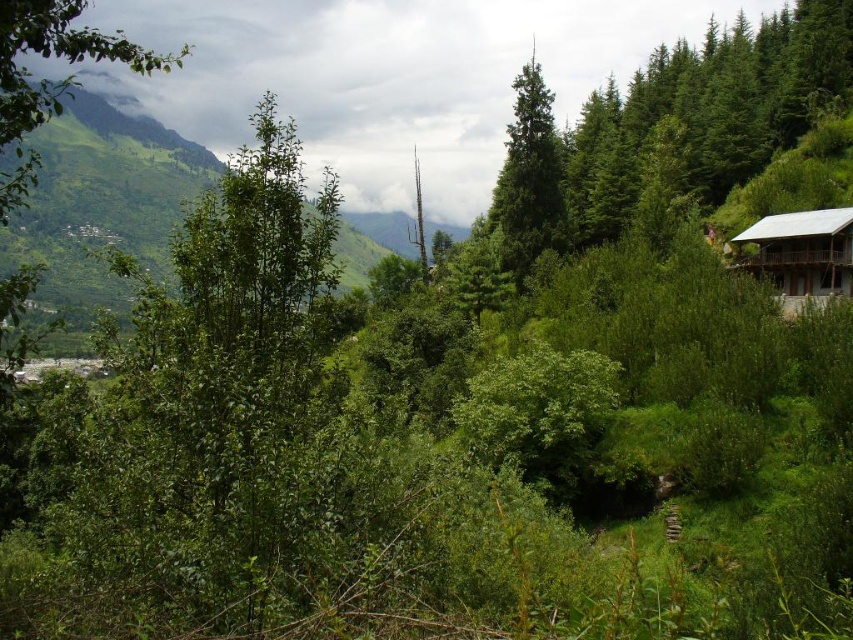
Question: Which is farther from the white wooden cabin at right?

Choices:
 (A) green matte tree at center
 (B) green matte tree at right

Answer: (B)

Question: Is green matte tree at right wider than green matte tree at center?

Choices:
 (A) no
 (B) yes

Answer: (B)

Question: Which point is closer to the camera taking this photo?

Choices:
 (A) (836, 228)
 (B) (509, 154)
 (C) (814, 17)

Answer: (A)

Question: Is green matte tree at right bigger than white wooden cabin at right?

Choices:
 (A) yes
 (B) no

Answer: (A)

Question: Which of these objects is positioned farthest from the green matte tree at center?

Choices:
 (A) white wooden cabin at right
 (B) green matte tree at right

Answer: (A)

Question: Is green matte tree at right to the left of white wooden cabin at right from the viewer's perspective?

Choices:
 (A) yes
 (B) no

Answer: (B)